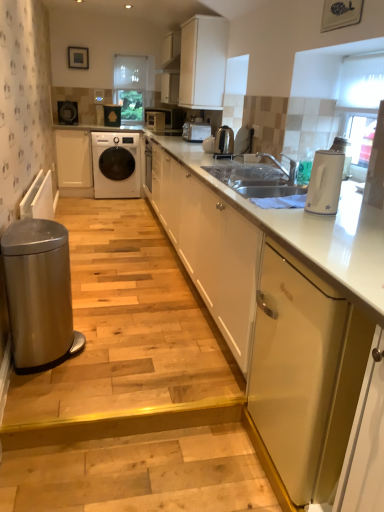
Identify the location of free space in front of stainless steel water heater at lower left. The image size is (384, 512). (52, 396).